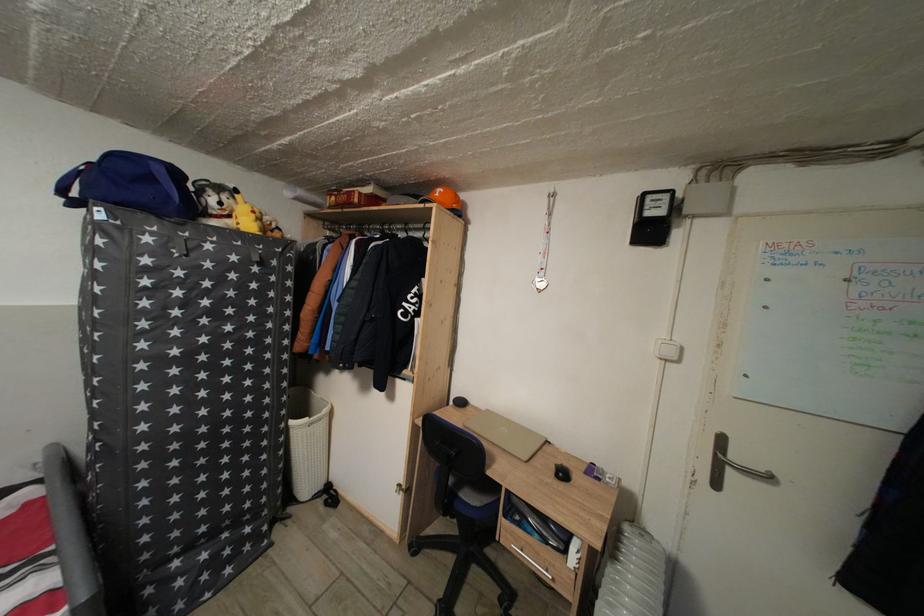
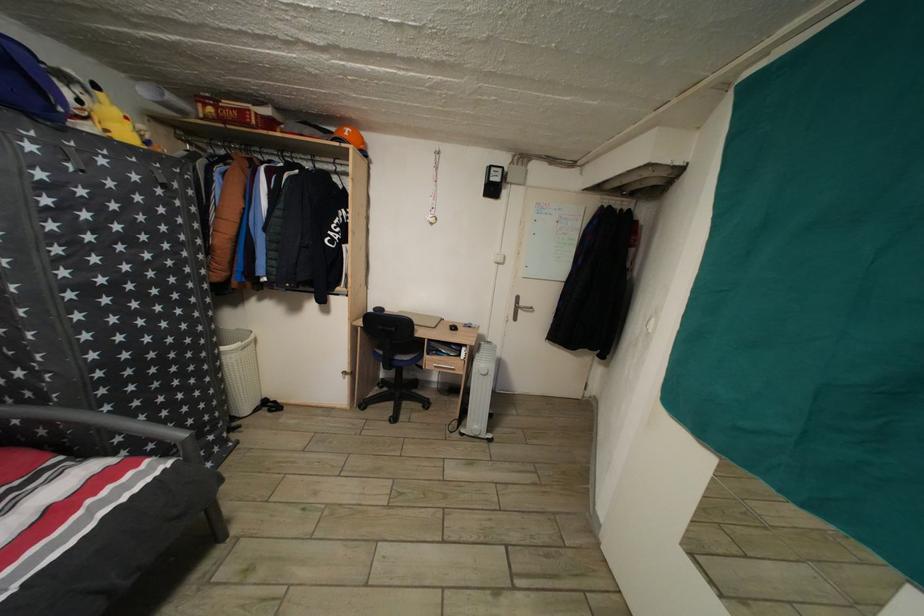
Locate, in the second image, the point that corresponds to point (444, 201) in the first image.

(354, 140)